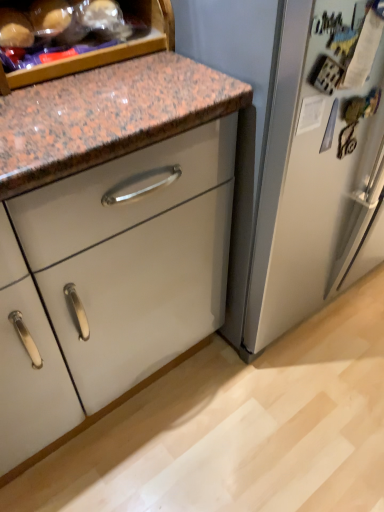
Question: Can you confirm if white glossy cabinet at center is shorter than translucent plastic bag at upper left?

Choices:
 (A) no
 (B) yes

Answer: (B)

Question: Is white glossy cabinet at center positioned far away from translucent plastic bag at upper left?

Choices:
 (A) yes
 (B) no

Answer: (B)

Question: Are white glossy cabinet at center and translucent plastic bag at upper left making contact?

Choices:
 (A) no
 (B) yes

Answer: (A)

Question: Is white glossy cabinet at center positioned behind translucent plastic bag at upper left?

Choices:
 (A) no
 (B) yes

Answer: (B)

Question: Is white glossy cabinet at center smaller than translucent plastic bag at upper left?

Choices:
 (A) yes
 (B) no

Answer: (B)

Question: Is white glossy cabinet at center oriented away from translucent plastic bag at upper left?

Choices:
 (A) yes
 (B) no

Answer: (B)

Question: Is translucent plastic bag at upper left thinner than white glossy cabinet at center?

Choices:
 (A) yes
 (B) no

Answer: (A)

Question: Is translucent plastic bag at upper left not near white glossy cabinet at center?

Choices:
 (A) yes
 (B) no

Answer: (B)

Question: Could you tell me if translucent plastic bag at upper left is turned towards white glossy cabinet at center?

Choices:
 (A) no
 (B) yes

Answer: (A)

Question: Is translucent plastic bag at upper left wider than white glossy cabinet at center?

Choices:
 (A) no
 (B) yes

Answer: (A)

Question: Can we say translucent plastic bag at upper left lies outside white glossy cabinet at center?

Choices:
 (A) yes
 (B) no

Answer: (A)

Question: Is translucent plastic bag at upper left to the left of white glossy cabinet at center from the viewer's perspective?

Choices:
 (A) yes
 (B) no

Answer: (A)

Question: Is translucent plastic bag at upper left spatially inside white glossy cabinet at center, or outside of it?

Choices:
 (A) inside
 (B) outside

Answer: (B)